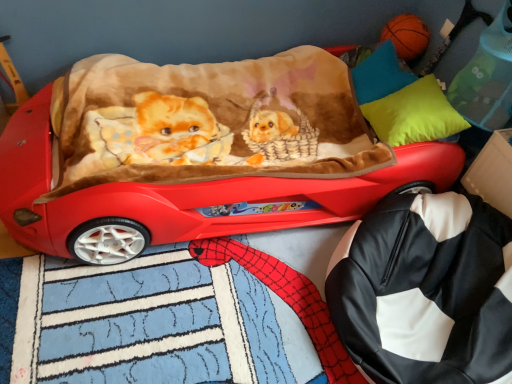
Question: Is black leather bag at lower right located within shiny red car at center?

Choices:
 (A) yes
 (B) no

Answer: (B)

Question: Is shiny red car at center not within black leather bag at lower right?

Choices:
 (A) no
 (B) yes

Answer: (B)

Question: From a real-world perspective, is shiny red car at center over black leather bag at lower right?

Choices:
 (A) yes
 (B) no

Answer: (A)

Question: Can you confirm if shiny red car at center is positioned to the left of black leather bag at lower right?

Choices:
 (A) no
 (B) yes

Answer: (B)

Question: Is shiny red car at center to the right of black leather bag at lower right from the viewer's perspective?

Choices:
 (A) yes
 (B) no

Answer: (B)

Question: Can you confirm if shiny red car at center is wider than black leather bag at lower right?

Choices:
 (A) yes
 (B) no

Answer: (A)

Question: Can you confirm if neon yellow fabric pillow at upper right, the second pillow in the top-to-bottom sequence, is smaller than matte blue pillow at upper right, positioned as the 1th pillow in top-to-bottom order?

Choices:
 (A) no
 (B) yes

Answer: (A)

Question: Is matte blue pillow at upper right, the 2th pillow when ordered from bottom to top, at the back of neon yellow fabric pillow at upper right, the second pillow in the top-to-bottom sequence?

Choices:
 (A) no
 (B) yes

Answer: (A)

Question: Is neon yellow fabric pillow at upper right, which ranks as the first pillow in bottom-to-top order, to the right of matte blue pillow at upper right, the 2th pillow when ordered from bottom to top, from the viewer's perspective?

Choices:
 (A) no
 (B) yes

Answer: (B)

Question: Are neon yellow fabric pillow at upper right, the second pillow in the top-to-bottom sequence, and matte blue pillow at upper right, positioned as the 1th pillow in top-to-bottom order, far apart?

Choices:
 (A) yes
 (B) no

Answer: (B)

Question: From a real-world perspective, is neon yellow fabric pillow at upper right, the second pillow in the top-to-bottom sequence, below matte blue pillow at upper right, the 2th pillow when ordered from bottom to top?

Choices:
 (A) yes
 (B) no

Answer: (B)

Question: Does neon yellow fabric pillow at upper right, which ranks as the first pillow in bottom-to-top order, turn towards matte blue pillow at upper right, positioned as the 1th pillow in top-to-bottom order?

Choices:
 (A) no
 (B) yes

Answer: (A)

Question: From a real-world perspective, is black leather bag at lower right physically below matte blue pillow at upper right, positioned as the 1th pillow in top-to-bottom order?

Choices:
 (A) no
 (B) yes

Answer: (B)